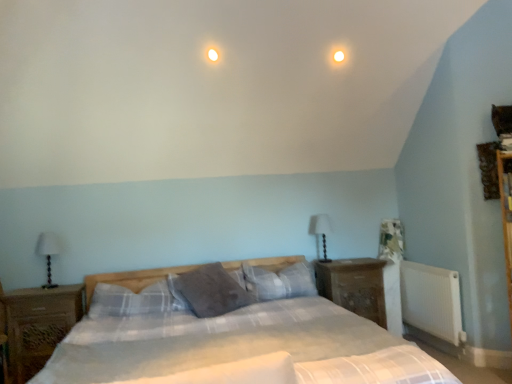
Locate an element on the screen. The image size is (512, 384). vacant space in front of white fabric lampshade at left, which ranks as the first table lamp in front-to-back order is located at coordinates (36, 292).